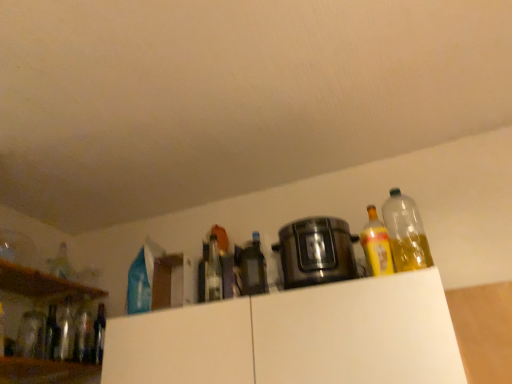
The width and height of the screenshot is (512, 384). Identify the location of matte glass bottle at center, the 3th bottle in the right-to-left sequence. (251, 268).

How much space does clear glass bottle at left, which is counted as the fifth bottle, starting from the right, occupy vertically?

It is 11.19 inches.

This screenshot has height=384, width=512. What do you see at coordinates (210, 273) in the screenshot?
I see `clear glass bottle at center, the 6th bottle in the left-to-right sequence` at bounding box center [210, 273].

This screenshot has width=512, height=384. What are the coordinates of `transparent plastic bottle at upper right, which is the 9th bottle in left-to-right order` in the screenshot? It's located at (405, 233).

Is clear glass bottle at left, the 5th bottle positioned from the left, to the right of transparent plastic bottle at upper right, the first bottle positioned from the right, from the viewer's perspective?

Incorrect, clear glass bottle at left, the 5th bottle positioned from the left, is not on the right side of transparent plastic bottle at upper right, the first bottle positioned from the right.

Does point (102, 336) come farther from viewer compared to point (406, 246)?

That is True.

From the picture: In terms of size, does clear glass bottle at left, which is counted as the fifth bottle, starting from the right, appear bigger or smaller than transparent plastic bottle at upper right, the first bottle positioned from the right?

In the image, clear glass bottle at left, which is counted as the fifth bottle, starting from the right, appears to be smaller than transparent plastic bottle at upper right, the first bottle positioned from the right.

Which of these two, translucent glass bottle at left, the ninth bottle when ordered from right to left, or white matte cabinet at upper center, placed as the first cabinetry when sorted from right to left, is bigger?

white matte cabinet at upper center, placed as the first cabinetry when sorted from right to left, is bigger.

From a real-world perspective, relative to white matte cabinet at upper center, which is the second cabinetry in left-to-right order, is translucent glass bottle at left, the ninth bottle when ordered from right to left, vertically above or below?

translucent glass bottle at left, the ninth bottle when ordered from right to left, is situated higher than white matte cabinet at upper center, which is the second cabinetry in left-to-right order, in the real world.

From the picture: What's the angular difference between translucent glass bottle at left, the ninth bottle when ordered from right to left, and white matte cabinet at upper center, placed as the first cabinetry when sorted from right to left,'s facing directions?

translucent glass bottle at left, the ninth bottle when ordered from right to left, and white matte cabinet at upper center, placed as the first cabinetry when sorted from right to left, are facing 88.1 degrees away from each other.

In the image, is translucent glass bottle at left, the ninth bottle when ordered from right to left, positioned in front of or behind white matte cabinet at upper center, placed as the first cabinetry when sorted from right to left?

Visually, translucent glass bottle at left, the ninth bottle when ordered from right to left, is located behind white matte cabinet at upper center, placed as the first cabinetry when sorted from right to left.

Is clear glass bottle at center, which ranks as the fourth bottle in right-to-left order, shorter than transparent plastic bottle at upper right, which is the 9th bottle in left-to-right order?

Yes.

Is transparent plastic bottle at upper right, the first bottle positioned from the right, a part of clear glass bottle at center, which ranks as the fourth bottle in right-to-left order?

Actually, transparent plastic bottle at upper right, the first bottle positioned from the right, is outside clear glass bottle at center, which ranks as the fourth bottle in right-to-left order.

Could you tell me if clear glass bottle at center, which ranks as the fourth bottle in right-to-left order, is facing transparent plastic bottle at upper right, the first bottle positioned from the right?

No, clear glass bottle at center, which ranks as the fourth bottle in right-to-left order, is not turned towards transparent plastic bottle at upper right, the first bottle positioned from the right.

How much distance is there between clear glass bottle at center, which ranks as the fourth bottle in right-to-left order, and transparent plastic bottle at upper right, which is the 9th bottle in left-to-right order?

clear glass bottle at center, which ranks as the fourth bottle in right-to-left order, is 71.99 centimeters away from transparent plastic bottle at upper right, which is the 9th bottle in left-to-right order.

Is point (32, 298) more distant than point (305, 234)?

Yes, point (32, 298) is farther from viewer.

From a real-world perspective, between matte glass bottles at left and satin black slow cooker at center, who is vertically higher?

matte glass bottles at left, from a real-world perspective.

The width and height of the screenshot is (512, 384). Find the location of `shelf located above the satin black slow cooker at center (from a real-world perspective)`. shelf located above the satin black slow cooker at center (from a real-world perspective) is located at coordinates (42, 284).

Would you say matte glass bottles at left is a long distance from satin black slow cooker at center?

Yes, matte glass bottles at left is far from satin black slow cooker at center.

Is white matte cabinet at upper center, which appears as the second cabinetry when viewed from the right, wider or thinner than yellow translucent bottle at right, acting as the second bottle starting from the right?

Considering their sizes, white matte cabinet at upper center, which appears as the second cabinetry when viewed from the right, looks slimmer than yellow translucent bottle at right, acting as the second bottle starting from the right.

From the picture: Is white matte cabinet at upper center, arranged as the first cabinetry when viewed from the left, looking in the opposite direction of yellow translucent bottle at right, acting as the second bottle starting from the right?

No, white matte cabinet at upper center, arranged as the first cabinetry when viewed from the left,'s orientation is not away from yellow translucent bottle at right, acting as the second bottle starting from the right.

Relative to yellow translucent bottle at right, acting as the second bottle starting from the right, is white matte cabinet at upper center, arranged as the first cabinetry when viewed from the left, in front or behind?

In the image, white matte cabinet at upper center, arranged as the first cabinetry when viewed from the left, appears behind yellow translucent bottle at right, acting as the second bottle starting from the right.

Is white matte cabinet at upper center, which appears as the second cabinetry when viewed from the right, with yellow translucent bottle at right, the 8th bottle viewed from the left?

white matte cabinet at upper center, which appears as the second cabinetry when viewed from the right, is not next to yellow translucent bottle at right, the 8th bottle viewed from the left, and they're not touching.

Is satin black slow cooker at center surrounding translucent glass bottle at left, which is counted as the first bottle, starting from the left?

No, satin black slow cooker at center does not contain translucent glass bottle at left, which is counted as the first bottle, starting from the left.

Does satin black slow cooker at center come in front of translucent glass bottle at left, the ninth bottle when ordered from right to left?

Yes, the depth of satin black slow cooker at center is less than that of translucent glass bottle at left, the ninth bottle when ordered from right to left.

Is satin black slow cooker at center placed right next to translucent glass bottle at left, which is counted as the first bottle, starting from the left?

satin black slow cooker at center and translucent glass bottle at left, which is counted as the first bottle, starting from the left, are clearly separated.

From the picture: Which object is positioned more to the right, satin black slow cooker at center or translucent glass bottle at left, the ninth bottle when ordered from right to left?

Positioned to the right is satin black slow cooker at center.

Consider the image. Is matte glass bottles at left at the back of white matte cabinet at upper center, placed as the first cabinetry when sorted from right to left?

No.

Considering the positions of objects white matte cabinet at upper center, placed as the first cabinetry when sorted from right to left, and matte glass bottles at left in the image provided, who is more to the left, white matte cabinet at upper center, placed as the first cabinetry when sorted from right to left, or matte glass bottles at left?

matte glass bottles at left is more to the left.

Based on the photo, how different are the orientations of white matte cabinet at upper center, placed as the first cabinetry when sorted from right to left, and matte glass bottles at left in degrees?

They differ by 90.8 degrees in their facing directions.

Is white matte cabinet at upper center, placed as the first cabinetry when sorted from right to left, with matte glass bottles at left?

No, white matte cabinet at upper center, placed as the first cabinetry when sorted from right to left, is not with matte glass bottles at left.

There is a clear glass bottle at left, which is counted as the fifth bottle, starting from the right. In order to click on the 4th bottle above it (from a real-world perspective) in this screenshot , I will do `click(405, 233)`.

The image size is (512, 384). Identify the location of cabinetry that is the 2nd object located in front of the translucent glass bottle at left, the ninth bottle when ordered from right to left. (295, 338).

Estimate the real-world distances between objects in this image. Which object is further from clear glass bottle at center, the 6th bottle in the left-to-right sequence, translucent glass bottle at left, marked as the 7th bottle in a right-to-left arrangement, or translucent glass bottle at left, which ranks as the second bottle in left-to-right order?

translucent glass bottle at left, which ranks as the second bottle in left-to-right order, is positioned further to the anchor clear glass bottle at center, the 6th bottle in the left-to-right sequence.

Considering their positions, is clear glass bottle at center, which ranks as the fourth bottle in right-to-left order, positioned further to translucent glass bottle at left, the third bottle viewed from the left, than translucent glass bottle at left, the eighth bottle viewed from the right?

clear glass bottle at center, which ranks as the fourth bottle in right-to-left order, lies further to translucent glass bottle at left, the third bottle viewed from the left, than the other object.

Looking at the image, which one is located closer to white matte cabinet at upper center, arranged as the first cabinetry when viewed from the left, satin black slow cooker at center or yellow translucent bottle at right, acting as the second bottle starting from the right?

satin black slow cooker at center.

When comparing their distances from white matte cabinet at upper center, placed as the first cabinetry when sorted from right to left, does satin black slow cooker at center or translucent glass bottle at left, the ninth bottle when ordered from right to left, seem closer?

satin black slow cooker at center lies closer to white matte cabinet at upper center, placed as the first cabinetry when sorted from right to left, than the other object.

Based on the photo, based on their spatial positions, is matte glass bottle at center, the seventh bottle when ordered from left to right, or satin black slow cooker at center further from clear glass bottle at center, which ranks as the fourth bottle in right-to-left order?

The object further to clear glass bottle at center, which ranks as the fourth bottle in right-to-left order, is satin black slow cooker at center.

Considering their positions, is white matte cabinet at upper center, which is the second cabinetry in left-to-right order, positioned further to yellow translucent bottle at right, the 8th bottle viewed from the left, than matte glass bottles at left?

matte glass bottles at left lies further to yellow translucent bottle at right, the 8th bottle viewed from the left, than the other object.

Considering their positions, is translucent glass bottle at left, the eighth bottle viewed from the right, positioned further to clear glass bottle at left, the 5th bottle positioned from the left, than satin black slow cooker at center?

The object further to clear glass bottle at left, the 5th bottle positioned from the left, is satin black slow cooker at center.

When comparing their distances from satin black slow cooker at center, does white matte cabinet at upper center, which is the second cabinetry in left-to-right order, or translucent glass bottle at left, which is counted as the first bottle, starting from the left, seem further?

Based on the image, translucent glass bottle at left, which is counted as the first bottle, starting from the left, appears to be further to satin black slow cooker at center.

In order to click on cabinetry between white matte cabinet at upper center, arranged as the first cabinetry when viewed from the left, and yellow translucent bottle at right, the 8th bottle viewed from the left, from left to right in this screenshot , I will do `click(295, 338)`.

Where is `cabinetry between translucent glass bottle at left, the ninth bottle when ordered from right to left, and clear glass bottle at center, which ranks as the fourth bottle in right-to-left order, in the horizontal direction`? The width and height of the screenshot is (512, 384). cabinetry between translucent glass bottle at left, the ninth bottle when ordered from right to left, and clear glass bottle at center, which ranks as the fourth bottle in right-to-left order, in the horizontal direction is located at coordinates (170, 281).

I want to click on cabinetry between matte glass bottles at left and white matte cabinet at upper center, which is the second cabinetry in left-to-right order, in the horizontal direction, so click(x=170, y=281).

The width and height of the screenshot is (512, 384). I want to click on bottle between white matte cabinet at upper center, which appears as the second cabinetry when viewed from the right, and matte glass bottle at center, the seventh bottle when ordered from left to right, so click(210, 273).